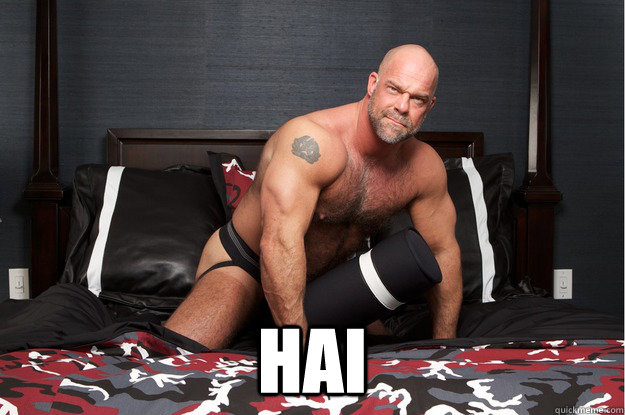
I want to click on box, so click(x=405, y=273).